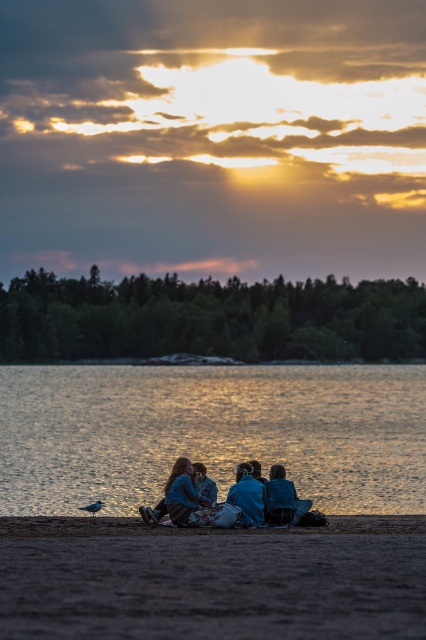
You are standing on the brown sandy beach at lower center and want to reach the glistening water at lower center. Which direction should you walk to get there?

Since the glistening water at lower center has a greater height compared to the brown sandy beach at lower center, you should walk towards the higher elevation to reach the glistening water at lower center.